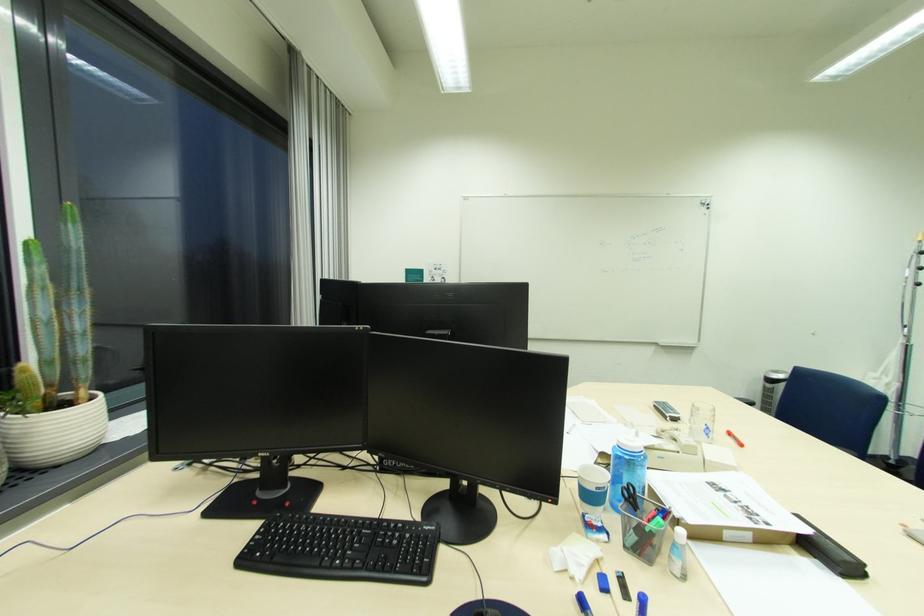
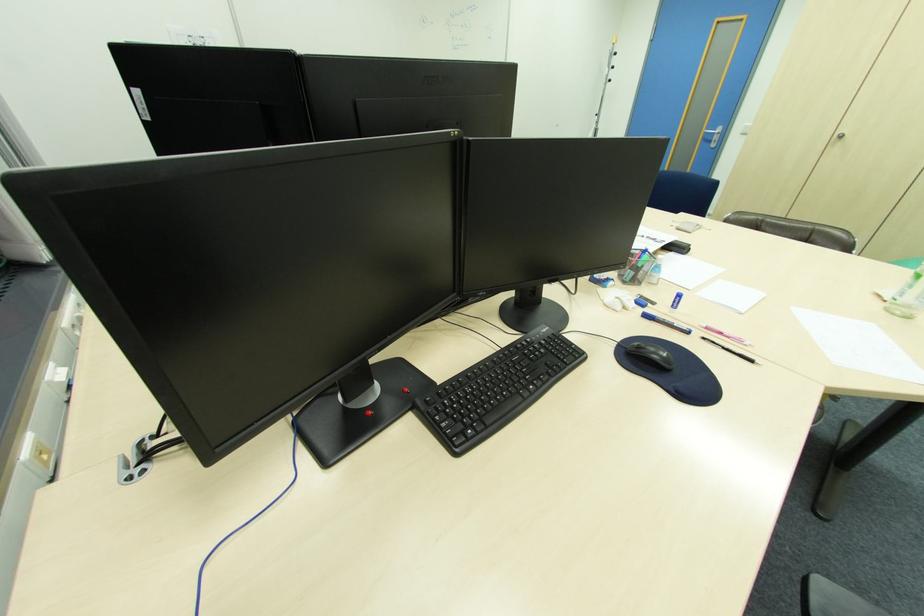
Find the pixel in the second image that matches point 639,537 in the first image.

(637, 274)